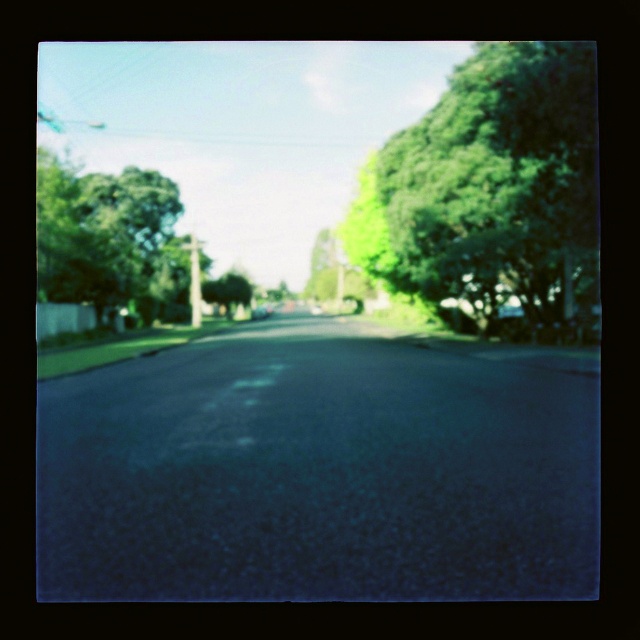
Question: Estimate the real-world distances between objects in this image. Which object is closer to the green leafy tree at left?

Choices:
 (A) green leafy tree at center
 (B) green leafy tree at right

Answer: (A)

Question: Which point is closer to the camera?

Choices:
 (A) (208, 301)
 (B) (83, 252)

Answer: (B)

Question: Does green leafy tree at left appear under green leafy tree at center?

Choices:
 (A) yes
 (B) no

Answer: (B)

Question: Considering the relative positions of green leafy tree at right and green leafy tree at center in the image provided, where is green leafy tree at right located with respect to green leafy tree at center?

Choices:
 (A) left
 (B) right

Answer: (B)

Question: Can you confirm if green leafy tree at right is smaller than green leafy tree at center?

Choices:
 (A) yes
 (B) no

Answer: (B)

Question: Which of the following is the closest to the observer?

Choices:
 (A) (90, 227)
 (B) (493, 99)

Answer: (B)